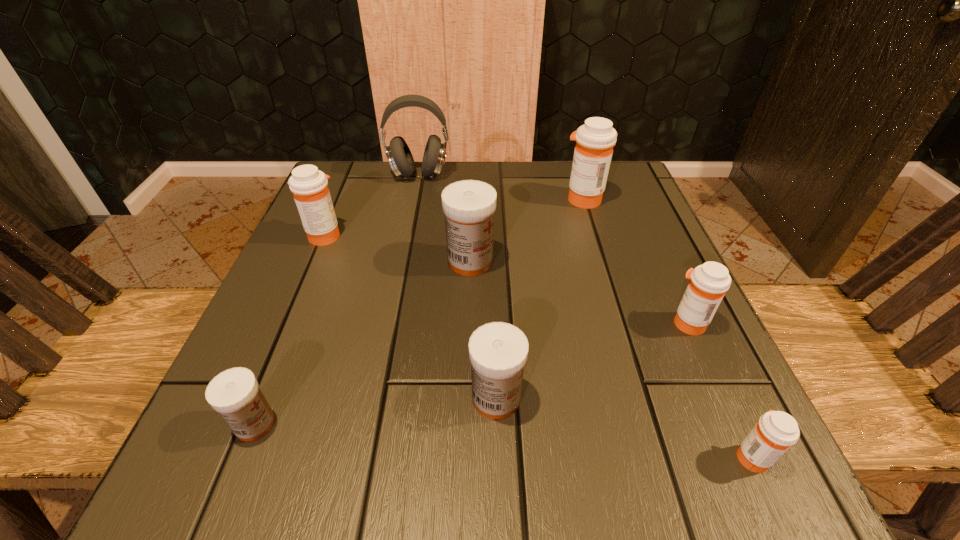
Locate an element on the screen. This screenshot has width=960, height=540. the smallest white medicine is located at coordinates (234, 393).

At what (x,y) coordinates should I click in order to perform the action: click on the smallest orange medicine. Please return your answer as a coordinate pair (x, y). The height and width of the screenshot is (540, 960). Looking at the image, I should click on (775, 432).

Find the location of `vacant space positioned 0.300m on the ear cups of the headset`. vacant space positioned 0.300m on the ear cups of the headset is located at coordinates (400, 271).

Locate an element on the screen. The image size is (960, 540). vacant space located on the left of the tallest medicine is located at coordinates (411, 199).

Locate an element on the screen. This screenshot has width=960, height=540. vacant space located on the back of the second farthest orange medicine is located at coordinates (340, 198).

You are a GUI agent. You are given a task and a screenshot of the screen. Output one action in this format:
    pyautogui.click(x=<x>, y=<y>)
    Task: Click on the free point located on the right of the farthest white medicine
    The height and width of the screenshot is (540, 960).
    Given the screenshot: What is the action you would take?
    pyautogui.click(x=594, y=261)

The height and width of the screenshot is (540, 960). I want to click on vacant space situated 0.110m on the left of the second nearest orange medicine, so click(603, 323).

The image size is (960, 540). In order to click on vacant space situated 0.140m on the right of the second smallest white medicine in this screenshot , I will do `click(621, 398)`.

The width and height of the screenshot is (960, 540). I want to click on vacant space located 0.310m on the right of the leftmost white medicine, so click(x=506, y=424).

Locate an element on the screen. The width and height of the screenshot is (960, 540). free space located on the left of the smallest orange medicine is located at coordinates click(x=594, y=456).